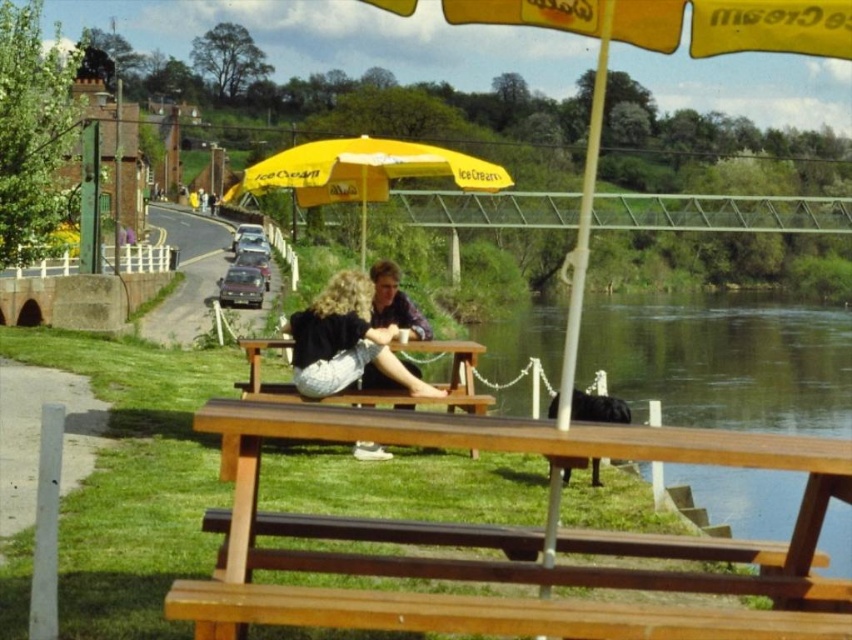
Question: Which object appears farthest from the camera in this image?

Choices:
 (A) yellow fabric umbrella at center
 (B) green smooth water at lower right
 (C) matte blue shirt at center

Answer: (A)

Question: Is green smooth water at lower right above denim skirt at center?

Choices:
 (A) yes
 (B) no

Answer: (A)

Question: Can you confirm if denim skirt at center is thinner than matte blue shirt at center?

Choices:
 (A) no
 (B) yes

Answer: (A)

Question: Is denim skirt at center thinner than matte blue shirt at center?

Choices:
 (A) yes
 (B) no

Answer: (B)

Question: Which point appears closest to the camera in this image?

Choices:
 (A) (301, 320)
 (B) (417, 317)

Answer: (A)

Question: Estimate the real-world distances between objects in this image. Which object is farther from the yellow fabric umbrella at center?

Choices:
 (A) green smooth water at lower right
 (B) matte blue shirt at center
 (C) brown wooden bench at lower center
 (D) denim skirt at center

Answer: (B)